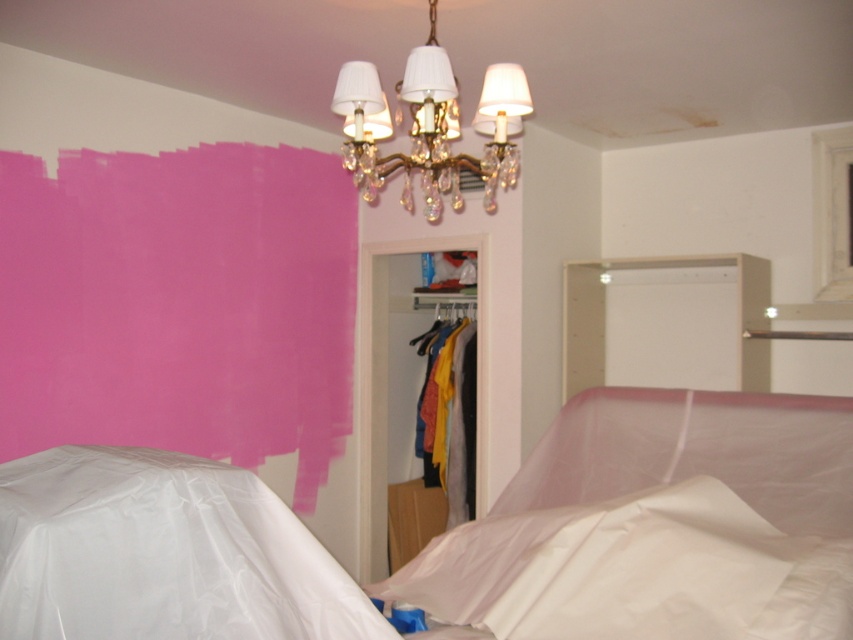
You are a delivery person who just arrived to deliver a new bed. You see the white plastic bed at lower left and the white matte plastic sheet at lower center in the room. Which object is taller?

The white plastic bed at lower left is taller than the white matte plastic sheet at lower center.

You are standing in the room and looking at two points on the wall. The first point is at coordinates point (428, 246) and the second point is at point (430, 56). Which point is closer to you?

Point (430, 56) is closer to you because it is less further to the camera than point (428, 246).

From the picture: You are a painter holding a 1.5 meter long paintbrush. You want to reach the white matte plastic sheet at lower center to paint it. Can you reach it with your paintbrush?

The distance between you and the white matte plastic sheet at lower center is 1.86 meters, and your paintbrush is only 1.5 meters long. Therefore, you cannot reach the white matte plastic sheet at lower center with your current paintbrush.